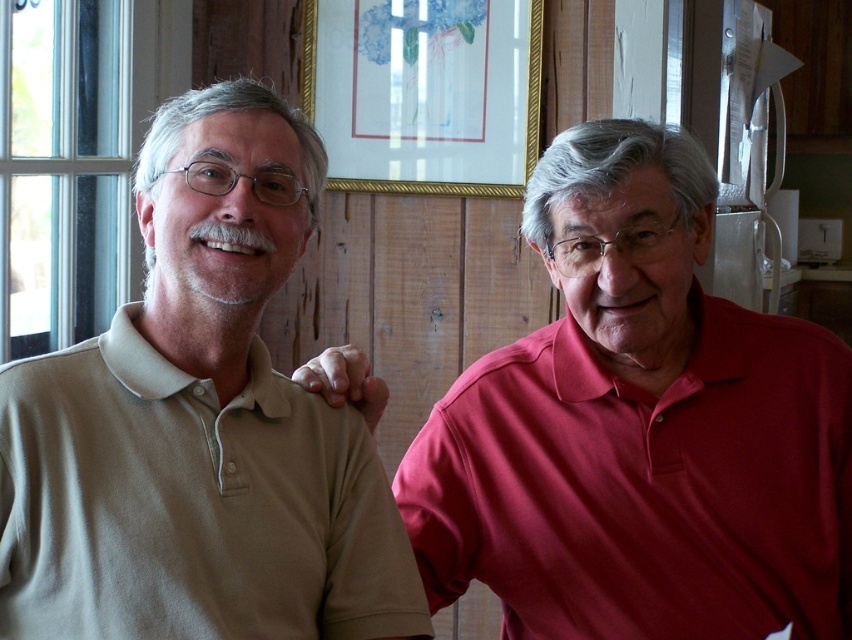
Which of these two, matte red polo shirt at right or gold-framed picture at upper center, stands taller?

matte red polo shirt at right

Does point (700, 348) lie in front of point (447, 8)?

Yes, point (700, 348) is in front of point (447, 8).

This screenshot has height=640, width=852. Find the location of `matte red polo shirt at right`. matte red polo shirt at right is located at coordinates (643, 484).

Who is shorter, beige cotton polo shirt at left or matte red polo shirt at right?

matte red polo shirt at right is shorter.

Is beige cotton polo shirt at left to the left of matte red polo shirt at right from the viewer's perspective?

Correct, you'll find beige cotton polo shirt at left to the left of matte red polo shirt at right.

Find the location of a particular element. The width and height of the screenshot is (852, 640). beige cotton polo shirt at left is located at coordinates (199, 424).

Does beige cotton polo shirt at left come behind gold-framed picture at upper center?

No, it is in front of gold-framed picture at upper center.

The height and width of the screenshot is (640, 852). Describe the element at coordinates (199, 424) in the screenshot. I see `beige cotton polo shirt at left` at that location.

Identify the location of beige cotton polo shirt at left. This screenshot has width=852, height=640. (199, 424).